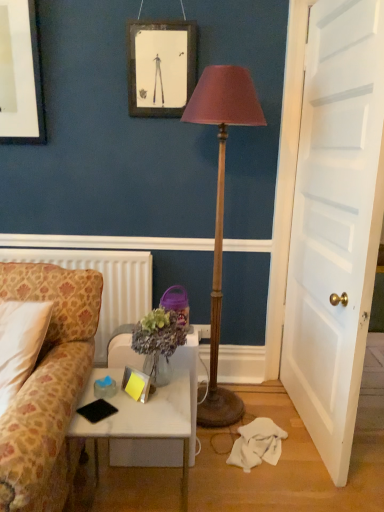
Question: Is white textured radiator at left at the left side of white wooden door at right?

Choices:
 (A) yes
 (B) no

Answer: (A)

Question: Considering the relative positions of white textured radiator at left and white wooden door at right in the image provided, is white textured radiator at left to the right of white wooden door at right from the viewer's perspective?

Choices:
 (A) yes
 (B) no

Answer: (B)

Question: From a real-world perspective, is white textured radiator at left located higher than white wooden door at right?

Choices:
 (A) yes
 (B) no

Answer: (B)

Question: Does white textured radiator at left have a larger size compared to white wooden door at right?

Choices:
 (A) yes
 (B) no

Answer: (B)

Question: From a real-world perspective, is white textured radiator at left under white wooden door at right?

Choices:
 (A) no
 (B) yes

Answer: (B)

Question: Relative to wooden framed picture at upper center, is patterned fabric couch at left in front or behind?

Choices:
 (A) front
 (B) behind

Answer: (A)

Question: From a real-world perspective, is patterned fabric couch at left positioned above or below wooden framed picture at upper center?

Choices:
 (A) above
 (B) below

Answer: (B)

Question: Considering the positions of patterned fabric couch at left and wooden framed picture at upper center in the image, is patterned fabric couch at left wider or thinner than wooden framed picture at upper center?

Choices:
 (A) wide
 (B) thin

Answer: (A)

Question: Is patterned fabric couch at left inside the boundaries of wooden framed picture at upper center, or outside?

Choices:
 (A) inside
 (B) outside

Answer: (B)

Question: Is point (147, 251) closer or farther from the camera than point (114, 417)?

Choices:
 (A) closer
 (B) farther

Answer: (B)

Question: In terms of width, does white textured radiator at left look wider or thinner when compared to white marble desk at lower left?

Choices:
 (A) wide
 (B) thin

Answer: (B)

Question: Considering the positions of white textured radiator at left and white marble desk at lower left in the image, is white textured radiator at left bigger or smaller than white marble desk at lower left?

Choices:
 (A) small
 (B) big

Answer: (A)

Question: From a real-world perspective, relative to white marble desk at lower left, is white textured radiator at left vertically above or below?

Choices:
 (A) above
 (B) below

Answer: (A)

Question: Would you say white wooden door at right is inside or outside patterned fabric couch at left?

Choices:
 (A) outside
 (B) inside

Answer: (A)

Question: Would you say white wooden door at right is to the left or to the right of patterned fabric couch at left in the picture?

Choices:
 (A) left
 (B) right

Answer: (B)